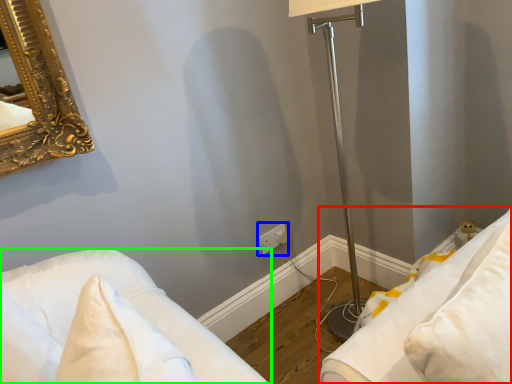
Question: Which object is positioned farthest from furniture (highlighted by a red box)? Select from electric outlet (highlighted by a blue box) and furniture (highlighted by a green box).

Choices:
 (A) electric outlet
 (B) furniture

Answer: (A)